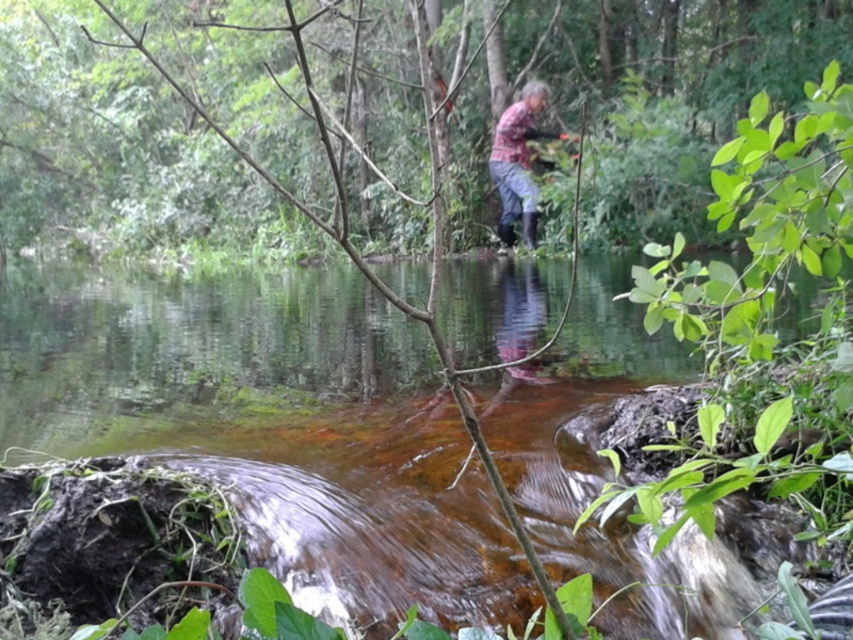
Is brown muddy water at center positioned at the back of plaid fabric shirt at center?

No, it is in front of plaid fabric shirt at center.

Is brown muddy water at center shorter than plaid fabric shirt at center?

Yes, brown muddy water at center is shorter than plaid fabric shirt at center.

Where is `brown muddy water at center`? This screenshot has width=853, height=640. brown muddy water at center is located at coordinates (274, 428).